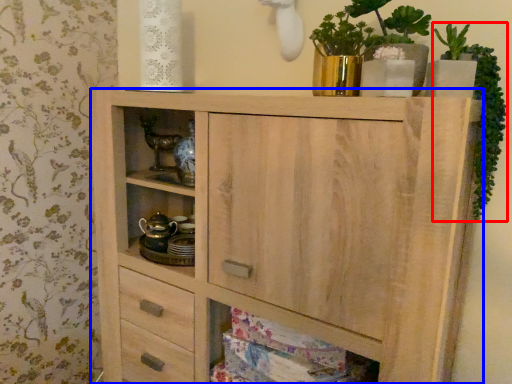
Question: Which of the following is the farthest to the observer, plant (highlighted by a red box) or chest of drawers (highlighted by a blue box)?

Choices:
 (A) plant
 (B) chest of drawers

Answer: (A)